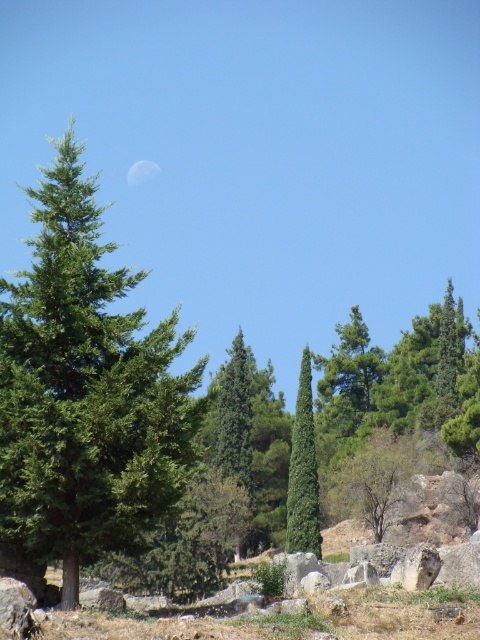
Question: Is green needle-like at center thinner than green matte tree at center?

Choices:
 (A) no
 (B) yes

Answer: (A)

Question: Is green needle-like at center thinner than green matte tree at center?

Choices:
 (A) no
 (B) yes

Answer: (A)

Question: Which object appears farthest from the camera in this image?

Choices:
 (A) green needle-like at center
 (B) green matte tree at center

Answer: (B)

Question: Which point is farther to the camera?

Choices:
 (A) (298, 451)
 (B) (128, 269)

Answer: (A)

Question: Which object is closer to the camera taking this photo?

Choices:
 (A) green matte tree at center
 (B) green needle-like at center

Answer: (B)

Question: Does green needle-like at center have a lesser width compared to green matte tree at center?

Choices:
 (A) yes
 (B) no

Answer: (B)